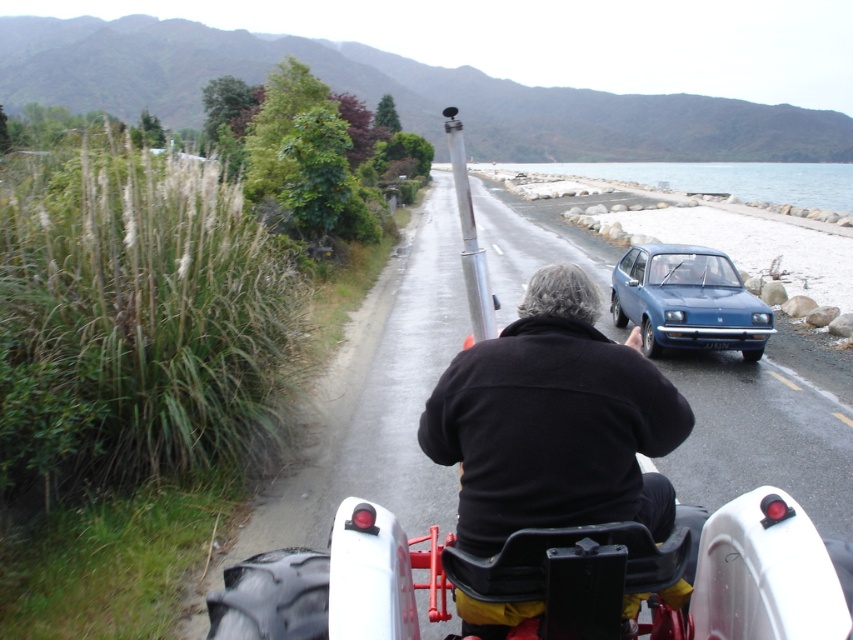
Is black soft jacket at center to the right of blue matte hatchback at center from the viewer's perspective?

In fact, black soft jacket at center is to the left of blue matte hatchback at center.

Consider the image. Is black soft jacket at center to the left of blue matte hatchback at center from the viewer's perspective?

Correct, you'll find black soft jacket at center to the left of blue matte hatchback at center.

Find the location of a particular element. This screenshot has height=640, width=853. black soft jacket at center is located at coordinates (553, 420).

Locate an element on the screen. The image size is (853, 640). black soft jacket at center is located at coordinates (553, 420).

Locate an element on the screen. The height and width of the screenshot is (640, 853). blue matte hatchback at center is located at coordinates (688, 300).

Who is shorter, blue matte hatchback at center or gray/rocky water at upper center?

With less height is blue matte hatchback at center.

Locate an element on the screen. The height and width of the screenshot is (640, 853). blue matte hatchback at center is located at coordinates [x=688, y=300].

Who is lower down, black soft jacket at center or gray/rocky water at upper center?

Positioned lower is black soft jacket at center.

Who is positioned more to the left, black soft jacket at center or gray/rocky water at upper center?

black soft jacket at center is more to the left.

Who is more forward, (x=618, y=502) or (x=529, y=164)?

Point (x=618, y=502) is in front.

Identify the location of black soft jacket at center. (553, 420).